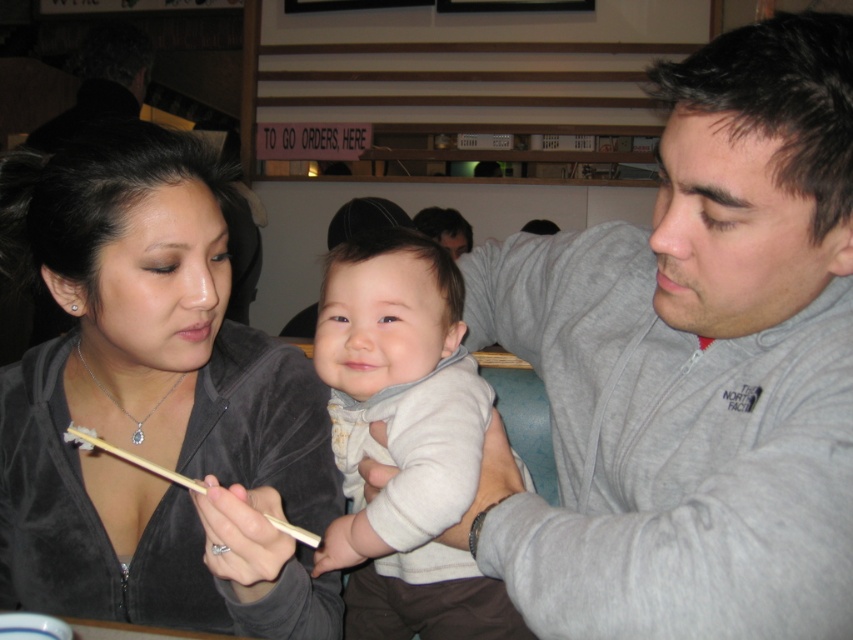
Which is more to the right, gray fleece jacket at upper right or light gray soft sweater at center?

From the viewer's perspective, gray fleece jacket at upper right appears more on the right side.

Can you confirm if gray fleece jacket at upper right is smaller than light gray soft sweater at center?

No, gray fleece jacket at upper right is not smaller than light gray soft sweater at center.

Which is in front, point (595, 618) or point (442, 332)?

Point (595, 618) is more forward.

You are a GUI agent. You are given a task and a screenshot of the screen. Output one action in this format:
    pyautogui.click(x=<x>, y=<y>)
    Task: Click on the gray fleece jacket at upper right
    Image resolution: width=853 pixels, height=640 pixels.
    Given the screenshot: What is the action you would take?
    pyautogui.click(x=691, y=365)

Does velvet gray hoodie at center appear on the left side of light gray soft sweater at center?

Indeed, velvet gray hoodie at center is positioned on the left side of light gray soft sweater at center.

Does velvet gray hoodie at center have a greater width compared to light gray soft sweater at center?

Yes.

Is point (132, 246) behind point (467, 604)?

No, it is not.

Where is `velvet gray hoodie at center`? This screenshot has height=640, width=853. velvet gray hoodie at center is located at coordinates (154, 404).

Does velvet gray hoodie at center have a smaller size compared to wooden chopsticks at lower center?

No, velvet gray hoodie at center is not smaller than wooden chopsticks at lower center.

Which is behind, point (16, 442) or point (293, 524)?

Point (16, 442)

The width and height of the screenshot is (853, 640). In order to click on velvet gray hoodie at center in this screenshot , I will do click(154, 404).